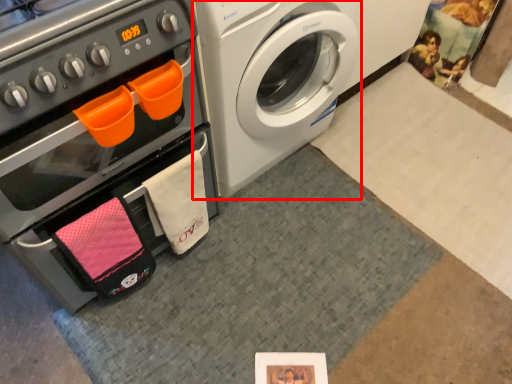
Question: Observing the image, what is the correct spatial positioning of washing machine (annotated by the red box) in reference to oven?

Choices:
 (A) left
 (B) right

Answer: (B)